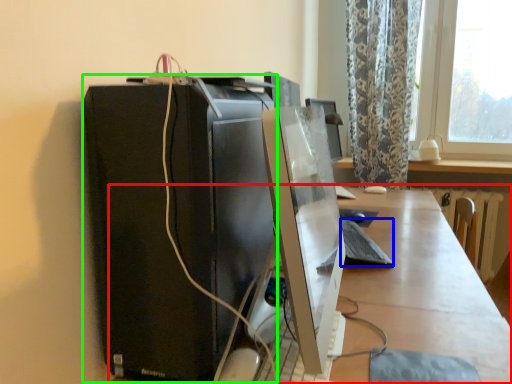
Question: Estimate the real-world distances between objects in this image. Which object is closer to desk (highlighted by a red box), computer keyboard (highlighted by a blue box) or computer tower (highlighted by a green box)?

Choices:
 (A) computer keyboard
 (B) computer tower

Answer: (A)